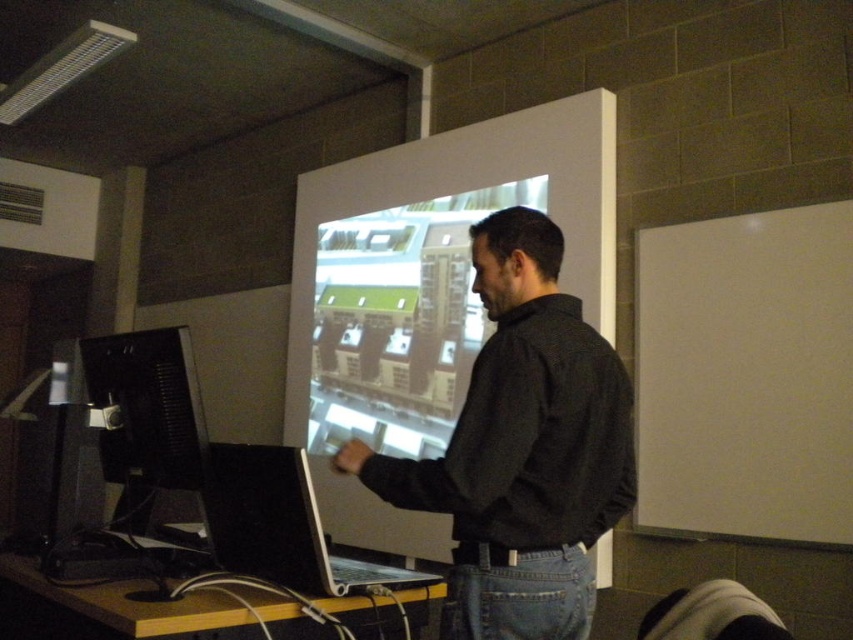
Question: Which of the following is the closest to the observer?

Choices:
 (A) matte glass projection screen at center
 (B) white matte projection screen at right
 (C) black matte shirt at center
 (D) black glossy monitor at left

Answer: (C)

Question: Is white matte projection screen at right to the right of silver metallic laptop at center from the viewer's perspective?

Choices:
 (A) no
 (B) yes

Answer: (B)

Question: Does white matte projection screen at right appear on the right side of matte glass projection screen at center?

Choices:
 (A) no
 (B) yes

Answer: (B)

Question: Which object is the closest to the white matte projection screen at right?

Choices:
 (A) matte glass projection screen at center
 (B) black matte shirt at center
 (C) black glossy monitor at left
 (D) silver metallic laptop at center

Answer: (A)

Question: Which point is farther to the camera?

Choices:
 (A) black glossy monitor at left
 (B) silver metallic laptop at center
 (C) black matte shirt at center

Answer: (A)

Question: Is white matte projection screen at right smaller than silver metallic laptop at center?

Choices:
 (A) yes
 (B) no

Answer: (B)